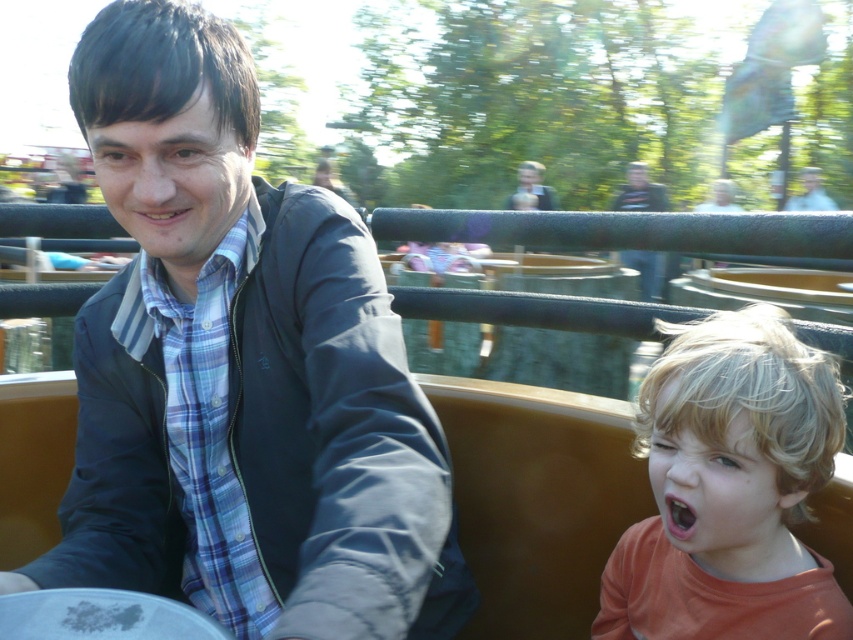
Which is in front, point (654, 570) or point (627, 259)?

Point (654, 570)

Who is higher up, blonde hair at lower right or dark blue jacket at upper center?

dark blue jacket at upper center

Find the location of a particular element. blonde hair at lower right is located at coordinates (730, 488).

Between blue plaid shirt at center and dark blue jacket at upper center, which one has more height?

blue plaid shirt at center is taller.

Which is more to the left, blue plaid shirt at center or dark blue jacket at upper center?

blue plaid shirt at center is more to the left.

Locate an element on the screen. blue plaid shirt at center is located at coordinates (241, 371).

Who is shorter, blonde hair at lower right or orange matte mouth at lower right?

orange matte mouth at lower right

Measure the distance between point (695, 480) and camera.

A distance of 3.49 feet exists between point (695, 480) and camera.

The image size is (853, 640). Find the location of `blonde hair at lower right`. blonde hair at lower right is located at coordinates pyautogui.click(x=730, y=488).